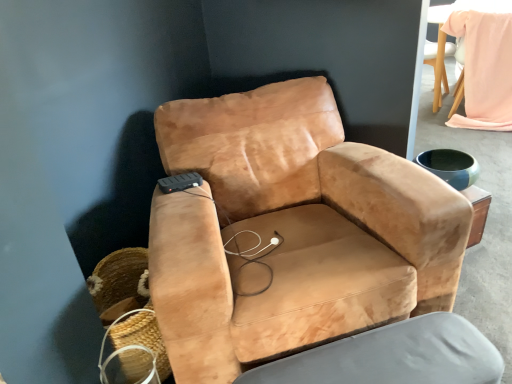
Question: From the image's perspective, would you say woven straw basket at lower left is shown under light pink fabric bean bag chair at upper right?

Choices:
 (A) yes
 (B) no

Answer: (A)

Question: Is woven straw basket at lower left at the right side of light pink fabric bean bag chair at upper right?

Choices:
 (A) yes
 (B) no

Answer: (B)

Question: Is the depth of woven straw basket at lower left greater than that of light pink fabric bean bag chair at upper right?

Choices:
 (A) yes
 (B) no

Answer: (B)

Question: Is woven straw basket at lower left to the left of light pink fabric bean bag chair at upper right from the viewer's perspective?

Choices:
 (A) yes
 (B) no

Answer: (A)

Question: From a real-world perspective, does woven straw basket at lower left sit lower than light pink fabric bean bag chair at upper right?

Choices:
 (A) yes
 (B) no

Answer: (A)

Question: From the image's perspective, is light pink fabric bean bag chair at upper right positioned above or below suede-like tan swivel chair at center?

Choices:
 (A) above
 (B) below

Answer: (A)

Question: Is light pink fabric bean bag chair at upper right wider or thinner than suede-like tan swivel chair at center?

Choices:
 (A) wide
 (B) thin

Answer: (A)

Question: Is point (481, 49) positioned closer to the camera than point (475, 367)?

Choices:
 (A) closer
 (B) farther

Answer: (B)

Question: Visually, is light pink fabric bean bag chair at upper right positioned to the left or to the right of suede-like tan swivel chair at center?

Choices:
 (A) left
 (B) right

Answer: (B)

Question: From the image's perspective, relative to suede tan armchair at center, is suede-like tan swivel chair at center above or below?

Choices:
 (A) below
 (B) above

Answer: (A)

Question: Is suede-like tan swivel chair at center to the left or to the right of suede tan armchair at center in the image?

Choices:
 (A) left
 (B) right

Answer: (B)

Question: From their relative heights in the image, would you say suede-like tan swivel chair at center is taller or shorter than suede tan armchair at center?

Choices:
 (A) short
 (B) tall

Answer: (A)

Question: Is point (421, 347) positioned closer to the camera than point (156, 134)?

Choices:
 (A) farther
 (B) closer

Answer: (B)

Question: Is point click(x=497, y=29) positioned closer to the camera than point click(x=157, y=359)?

Choices:
 (A) farther
 (B) closer

Answer: (A)

Question: From the image's perspective, relative to woven straw basket at lower left, is light pink fabric bean bag chair at upper right above or below?

Choices:
 (A) above
 (B) below

Answer: (A)